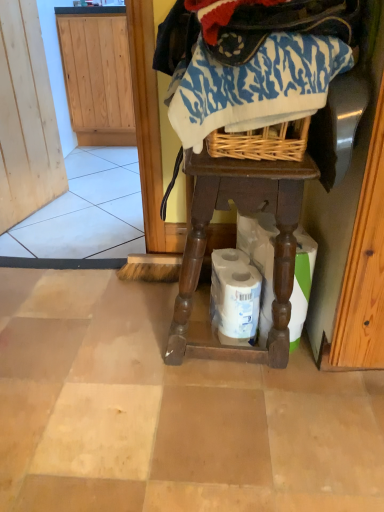
The height and width of the screenshot is (512, 384). Identify the location of blue printed fabric at center. (254, 86).

In order to face brown wooden table at center, should I rotate leftwards or rightwards?

It's best to rotate right around 4.430 degrees.

This screenshot has width=384, height=512. What do you see at coordinates (235, 297) in the screenshot? I see `white matte toilet paper at lower center, placed as the second toilet paper when sorted from right to left` at bounding box center [235, 297].

Locate an element on the screen. white matte toilet paper at lower center, which ranks as the 2th toilet paper in left-to-right order is located at coordinates (260, 260).

You are a GUI agent. You are given a task and a screenshot of the screen. Output one action in this format:
    pyautogui.click(x=<x>, y=<y>)
    Task: Click on the blue printed fabric at center
    This screenshot has width=384, height=512.
    Given the screenshot: What is the action you would take?
    pyautogui.click(x=254, y=86)

Image resolution: width=384 pixels, height=512 pixels. I want to click on clothing in front of the white matte toilet paper at lower center, which ranks as the 2th toilet paper in left-to-right order, so click(254, 86).

Considering the positions of objects white matte toilet paper at lower center, which ranks as the 2th toilet paper in left-to-right order, and blue printed fabric at center in the image provided, who is in front, white matte toilet paper at lower center, which ranks as the 2th toilet paper in left-to-right order, or blue printed fabric at center?

blue printed fabric at center is more forward.

From a real-world perspective, is white matte toilet paper at lower center, which ranks as the 1th toilet paper in right-to-left order, above or below blue printed fabric at center?

From a real-world perspective, white matte toilet paper at lower center, which ranks as the 1th toilet paper in right-to-left order, is physically below blue printed fabric at center.

Considering the positions of point (307, 249) and point (304, 82), is point (307, 249) closer or farther from the camera than point (304, 82)?

Clearly, point (307, 249) is more distant from the camera than point (304, 82).

Is white matte toilet paper at lower center, which ranks as the 2th toilet paper in left-to-right order, oriented away from brown wooden table at center?

Yes, white matte toilet paper at lower center, which ranks as the 2th toilet paper in left-to-right order,'s orientation is away from brown wooden table at center.

Does white matte toilet paper at lower center, which ranks as the 1th toilet paper in right-to-left order, have a greater width compared to brown wooden table at center?

No.

Does point (299, 274) come behind point (274, 183)?

Yes, point (299, 274) is behind point (274, 183).

What's the angular difference between white matte toilet paper at lower center, which ranks as the 1th toilet paper in right-to-left order, and brown wooden table at center's facing directions?

They differ by 64.9 degrees in their facing directions.

Can you confirm if white matte toilet paper at lower center, placed as the second toilet paper when sorted from right to left, is bigger than white matte toilet paper at lower center, which ranks as the 1th toilet paper in right-to-left order?

Actually, white matte toilet paper at lower center, placed as the second toilet paper when sorted from right to left, might be smaller than white matte toilet paper at lower center, which ranks as the 1th toilet paper in right-to-left order.

Does white matte toilet paper at lower center, placed as the second toilet paper when sorted from right to left, come in front of white matte toilet paper at lower center, which ranks as the 1th toilet paper in right-to-left order?

No, white matte toilet paper at lower center, placed as the second toilet paper when sorted from right to left, is further to the viewer.

Is white matte toilet paper at lower center, placed as the second toilet paper when sorted from right to left, facing away from white matte toilet paper at lower center, which ranks as the 2th toilet paper in left-to-right order?

Yes.

In the scene shown: From a real-world perspective, is white matte toilet paper at lower center, placed as the second toilet paper when sorted from right to left, above or below white matte toilet paper at lower center, which ranks as the 1th toilet paper in right-to-left order?

white matte toilet paper at lower center, placed as the second toilet paper when sorted from right to left, is situated lower than white matte toilet paper at lower center, which ranks as the 1th toilet paper in right-to-left order, in the real world.

Considering the relative sizes of white matte toilet paper at lower center, which ranks as the 1th toilet paper in right-to-left order, and white matte toilet paper at lower center, which is the 1th toilet paper in left-to-right order, in the image provided, is white matte toilet paper at lower center, which ranks as the 1th toilet paper in right-to-left order, shorter than white matte toilet paper at lower center, which is the 1th toilet paper in left-to-right order,?

Incorrect, the height of white matte toilet paper at lower center, which ranks as the 1th toilet paper in right-to-left order, does not fall short of that of white matte toilet paper at lower center, which is the 1th toilet paper in left-to-right order.

Is white matte toilet paper at lower center, which ranks as the 1th toilet paper in right-to-left order, inside the boundaries of white matte toilet paper at lower center, placed as the second toilet paper when sorted from right to left, or outside?

white matte toilet paper at lower center, which ranks as the 1th toilet paper in right-to-left order, cannot be found inside white matte toilet paper at lower center, placed as the second toilet paper when sorted from right to left.

What's the angular difference between white matte toilet paper at lower center, which ranks as the 1th toilet paper in right-to-left order, and white matte toilet paper at lower center, placed as the second toilet paper when sorted from right to left,'s facing directions?

2.27 degrees separate the facing orientations of white matte toilet paper at lower center, which ranks as the 1th toilet paper in right-to-left order, and white matte toilet paper at lower center, placed as the second toilet paper when sorted from right to left.

From a real-world perspective, is white matte toilet paper at lower center, which ranks as the 1th toilet paper in right-to-left order, on white matte toilet paper at lower center, which is the 1th toilet paper in left-to-right order?

Yes, from a real-world perspective, white matte toilet paper at lower center, which ranks as the 1th toilet paper in right-to-left order, is above white matte toilet paper at lower center, which is the 1th toilet paper in left-to-right order.

From the image's perspective, would you say brown wooden table at center is shown under white matte toilet paper at lower center, which ranks as the 1th toilet paper in right-to-left order?

No, from the image's perspective, brown wooden table at center is not beneath white matte toilet paper at lower center, which ranks as the 1th toilet paper in right-to-left order.

Can you see brown wooden table at center touching white matte toilet paper at lower center, which ranks as the 2th toilet paper in left-to-right order?

No.

Looking at this image, is brown wooden table at center located outside white matte toilet paper at lower center, which ranks as the 1th toilet paper in right-to-left order?

Yes.

Does point (207, 167) come closer to viewer compared to point (301, 233)?

Yes, point (207, 167) is in front of point (301, 233).

Is point (218, 258) positioned before point (199, 196)?

No, (218, 258) is further to viewer.

Is white matte toilet paper at lower center, which is the 1th toilet paper in left-to-right order, turned away from brown wooden table at center?

Yes.

Does white matte toilet paper at lower center, which is the 1th toilet paper in left-to-right order, lie behind brown wooden table at center?

Yes, white matte toilet paper at lower center, which is the 1th toilet paper in left-to-right order, is behind brown wooden table at center.

From a real-world perspective, is brown wooden table at center physically below blue printed fabric at center?

Yes.

Is brown wooden table at center situated inside blue printed fabric at center or outside?

brown wooden table at center is spatially situated outside blue printed fabric at center.

Can you tell me how much brown wooden table at center and blue printed fabric at center differ in facing direction?

2.8 degrees.

From the image's perspective, does brown wooden table at center appear lower than blue printed fabric at center?

Indeed, from the image's perspective, brown wooden table at center is shown beneath blue printed fabric at center.

Locate an element on the screen. Image resolution: width=384 pixels, height=512 pixels. clothing on the left of white matte toilet paper at lower center, which ranks as the 1th toilet paper in right-to-left order is located at coordinates (254, 86).

Image resolution: width=384 pixels, height=512 pixels. Identify the location of furniture positioned vertically above the white matte toilet paper at lower center, which ranks as the 1th toilet paper in right-to-left order (from a real-world perspective). (246, 212).

Looking at this image, considering their positions, is white matte toilet paper at lower center, which is the 1th toilet paper in left-to-right order, positioned further to brown wooden table at center than blue printed fabric at center?

Based on the image, blue printed fabric at center appears to be further to brown wooden table at center.

From the image, which object appears to be farther from blue printed fabric at center, white matte toilet paper at lower center, which ranks as the 2th toilet paper in left-to-right order, or white matte toilet paper at lower center, which is the 1th toilet paper in left-to-right order?

Among the two, white matte toilet paper at lower center, which is the 1th toilet paper in left-to-right order, is located further to blue printed fabric at center.

When comparing their distances from white matte toilet paper at lower center, which ranks as the 1th toilet paper in right-to-left order, does white matte toilet paper at lower center, placed as the second toilet paper when sorted from right to left, or brown wooden table at center seem closer?

Among the two, white matte toilet paper at lower center, placed as the second toilet paper when sorted from right to left, is located nearer to white matte toilet paper at lower center, which ranks as the 1th toilet paper in right-to-left order.

Based on their spatial positions, is blue printed fabric at center or white matte toilet paper at lower center, which is the 1th toilet paper in left-to-right order, further from brown wooden table at center?

blue printed fabric at center is further to brown wooden table at center.

From the image, which object appears to be nearer to white matte toilet paper at lower center, which ranks as the 1th toilet paper in right-to-left order, blue printed fabric at center or white matte toilet paper at lower center, placed as the second toilet paper when sorted from right to left?

Based on the image, white matte toilet paper at lower center, placed as the second toilet paper when sorted from right to left, appears to be nearer to white matte toilet paper at lower center, which ranks as the 1th toilet paper in right-to-left order.

From the image, which object appears to be farther from blue printed fabric at center, white matte toilet paper at lower center, which ranks as the 1th toilet paper in right-to-left order, or brown wooden table at center?

The object further to blue printed fabric at center is white matte toilet paper at lower center, which ranks as the 1th toilet paper in right-to-left order.

When comparing their distances from white matte toilet paper at lower center, which ranks as the 1th toilet paper in right-to-left order, does brown wooden table at center or blue printed fabric at center seem further?

Based on the image, blue printed fabric at center appears to be further to white matte toilet paper at lower center, which ranks as the 1th toilet paper in right-to-left order.

When comparing their distances from white matte toilet paper at lower center, which is the 1th toilet paper in left-to-right order, does white matte toilet paper at lower center, which ranks as the 2th toilet paper in left-to-right order, or blue printed fabric at center seem further?

Based on the image, blue printed fabric at center appears to be further to white matte toilet paper at lower center, which is the 1th toilet paper in left-to-right order.

Find the location of a particular element. toilet paper located between brown wooden table at center and white matte toilet paper at lower center, which is the 1th toilet paper in left-to-right order, in the depth direction is located at coordinates (260, 260).

I want to click on toilet paper between blue printed fabric at center and white matte toilet paper at lower center, which is the 1th toilet paper in left-to-right order, in the up-down direction, so click(260, 260).

Locate an element on the screen. Image resolution: width=384 pixels, height=512 pixels. furniture between blue printed fabric at center and white matte toilet paper at lower center, placed as the second toilet paper when sorted from right to left, in the up-down direction is located at coordinates (246, 212).

You are a GUI agent. You are given a task and a screenshot of the screen. Output one action in this format:
    pyautogui.click(x=<x>, y=<y>)
    Task: Click on the furniture that lies between blue printed fabric at center and white matte toilet paper at lower center, which ranks as the 2th toilet paper in left-to-right order, from top to bottom
    
    Given the screenshot: What is the action you would take?
    pyautogui.click(x=246, y=212)